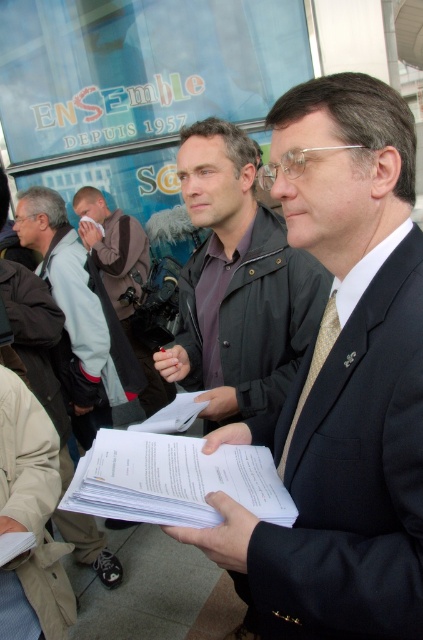
Can you confirm if matte black suit at center is taller than gold textured tie at center?

Indeed, matte black suit at center has a greater height compared to gold textured tie at center.

Who is more distant from viewer, (368, 400) or (329, 316)?

Point (329, 316)

Locate an element on the screen. matte black suit at center is located at coordinates (340, 384).

Can you confirm if light gray jacket at left is taller than gold textured tie at center?

Indeed, light gray jacket at left has a greater height compared to gold textured tie at center.

Is light gray jacket at left closer to camera compared to gold textured tie at center?

No, it is not.

Between point (19, 211) and point (327, 339), which one is positioned behind?

The point (19, 211) is more distant.

I want to click on light gray jacket at left, so click(68, 280).

Is matte black suit at center further to the viewer compared to matte black jacket at center?

That is False.

From the picture: Who is higher up, matte black suit at center or matte black jacket at center?

matte black jacket at center is above.

Is point (351, 602) behind point (263, 280)?

That is False.

Find the location of `matte black suit at center`. matte black suit at center is located at coordinates (340, 384).